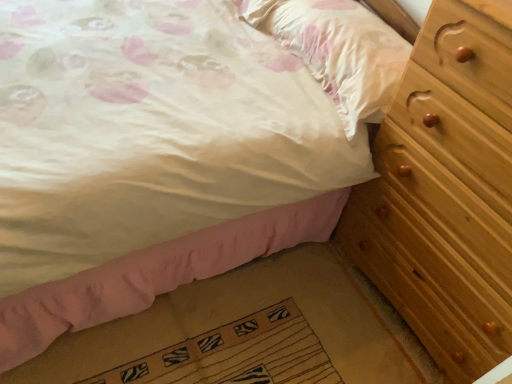
Question: From the image's perspective, is wooden bed frame at lower right below matte white pillow at upper right?

Choices:
 (A) no
 (B) yes

Answer: (B)

Question: From a real-world perspective, is wooden bed frame at lower right beneath matte white pillow at upper right?

Choices:
 (A) yes
 (B) no

Answer: (A)

Question: Is wooden bed frame at lower right positioned in front of matte white pillow at upper right?

Choices:
 (A) no
 (B) yes

Answer: (B)

Question: Is wooden bed frame at lower right smaller than matte white pillow at upper right?

Choices:
 (A) no
 (B) yes

Answer: (A)

Question: Is matte white pillow at upper right located within wooden bed frame at lower right?

Choices:
 (A) no
 (B) yes

Answer: (A)

Question: Does wooden bed frame at lower right have a lesser width compared to matte white pillow at upper right?

Choices:
 (A) yes
 (B) no

Answer: (B)

Question: Is matte white pillow at upper right at the right side of wooden bed frame at lower right?

Choices:
 (A) yes
 (B) no

Answer: (A)

Question: From the image's perspective, is matte white pillow at upper right under wooden bed frame at lower right?

Choices:
 (A) no
 (B) yes

Answer: (A)

Question: Can you confirm if matte white pillow at upper right is smaller than wooden bed frame at lower right?

Choices:
 (A) no
 (B) yes

Answer: (B)

Question: Could you tell me if matte white pillow at upper right is turned towards wooden bed frame at lower right?

Choices:
 (A) no
 (B) yes

Answer: (A)

Question: From a real-world perspective, does matte white pillow at upper right stand above wooden bed frame at lower right?

Choices:
 (A) yes
 (B) no

Answer: (A)

Question: Is matte white pillow at upper right taller than wooden bed frame at lower right?

Choices:
 (A) no
 (B) yes

Answer: (B)

Question: Is light brown wooden chest of drawers at right facing away from matte white pillow at upper right?

Choices:
 (A) no
 (B) yes

Answer: (A)